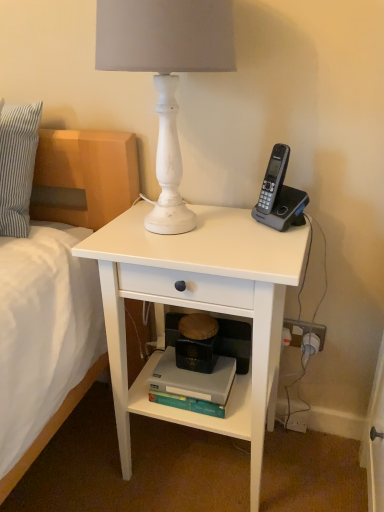
The height and width of the screenshot is (512, 384). Find the location of `free area in between white matte lamp at upper center and gray plastic phone at upper right`. free area in between white matte lamp at upper center and gray plastic phone at upper right is located at coordinates (241, 228).